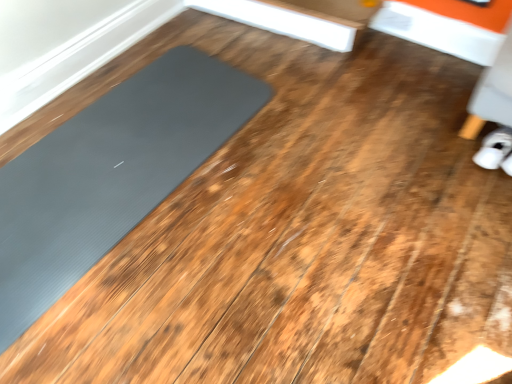
You are a GUI agent. You are given a task and a screenshot of the screen. Output one action in this format:
    pyautogui.click(x=<x>, y=<y>)
    Task: Click on the vacant region to the left of white fabric shoe at lower right
    The height and width of the screenshot is (384, 512).
    Given the screenshot: What is the action you would take?
    pyautogui.click(x=450, y=153)